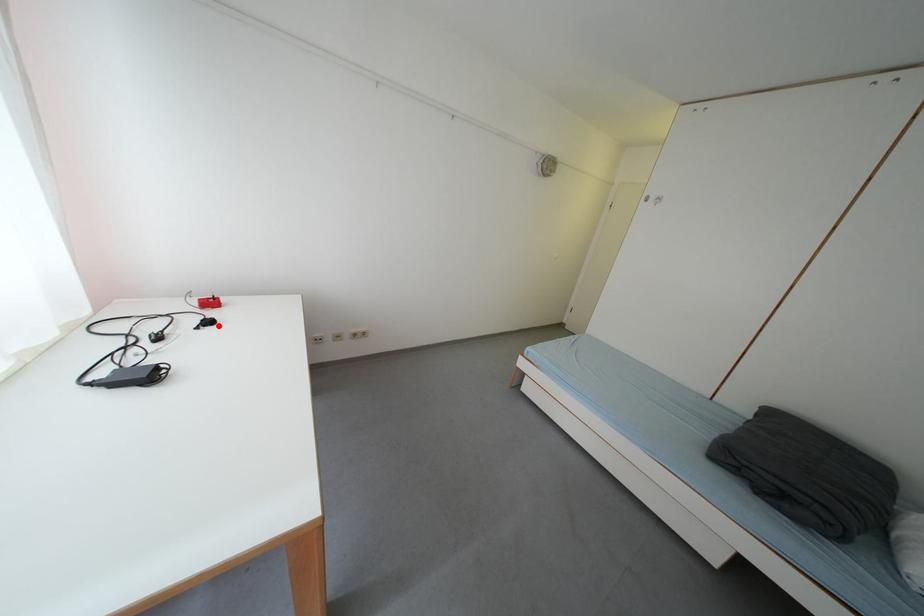
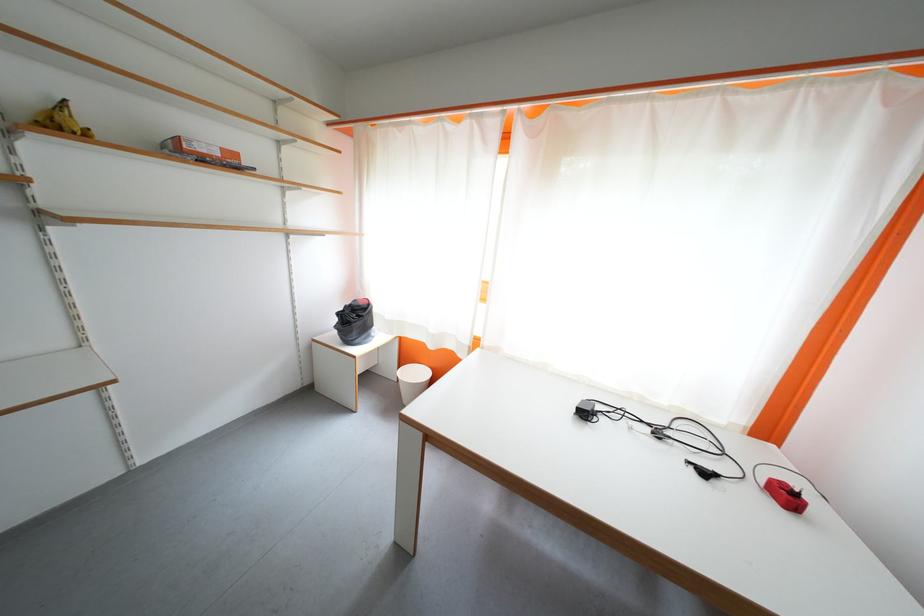
In the second image, find the point that corresponds to the highlighted location in the first image.

(713, 477)